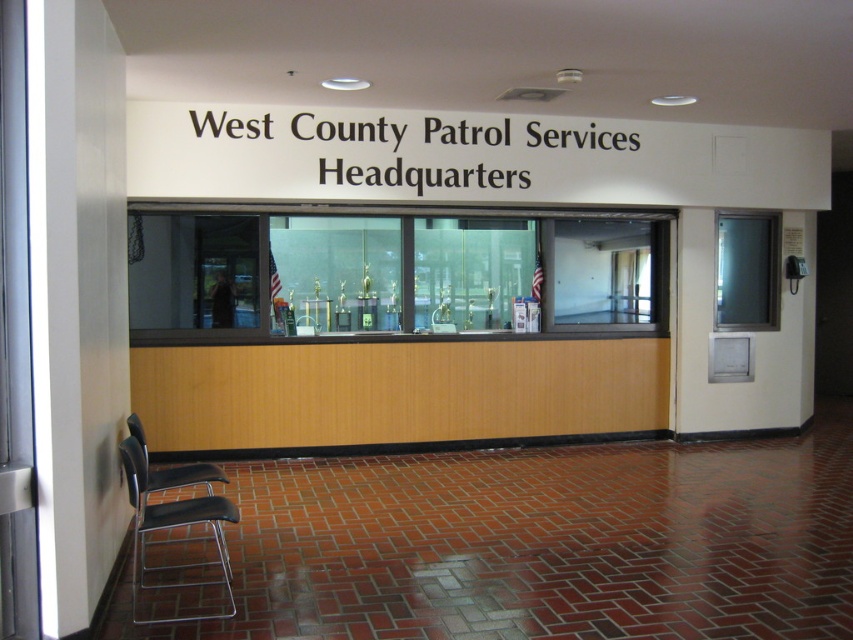
Is black metal chair at lower left behind metallic gray chair at lower left?

No, black metal chair at lower left is closer to the viewer.

From the picture: Is black metal chair at lower left thinner than metallic gray chair at lower left?

No.

Is point (194, 513) less distant than point (161, 490)?

Yes, point (194, 513) is closer to viewer.

I want to click on black metal chair at lower left, so click(x=172, y=528).